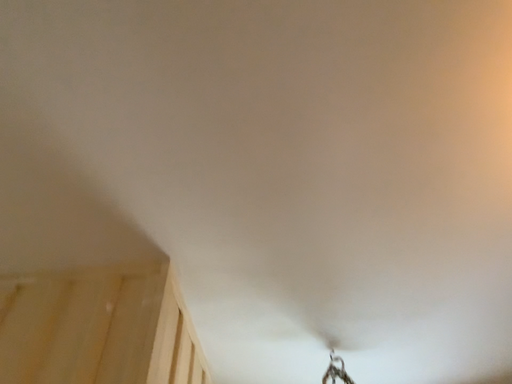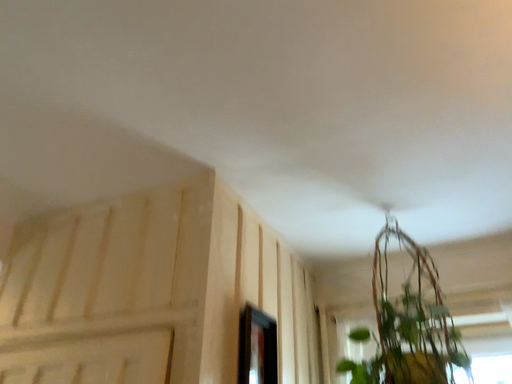
Question: How did the camera likely rotate when shooting the video?

Choices:
 (A) rotated upward
 (B) rotated downward

Answer: (B)